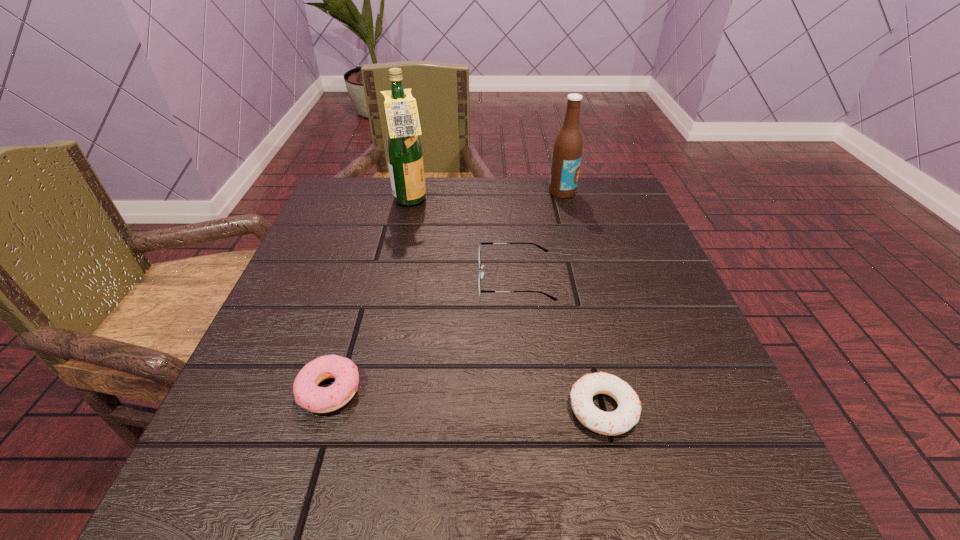
The image size is (960, 540). In order to click on vacant area situated on the lenses of the third shortest object in this screenshot , I will do `click(349, 279)`.

This screenshot has width=960, height=540. Find the location of `free spot located 0.360m on the right of the left doughnut`. free spot located 0.360m on the right of the left doughnut is located at coordinates (602, 390).

This screenshot has height=540, width=960. I want to click on free location located on the back of the right doughnut, so click(571, 274).

I want to click on liquor that is at the far edge, so click(x=404, y=150).

This screenshot has height=540, width=960. What are the coordinates of `beer bottle that is at the far edge` in the screenshot? It's located at (567, 152).

Where is `liquor that is at the left edge`? The height and width of the screenshot is (540, 960). liquor that is at the left edge is located at coordinates (404, 150).

Find the location of a particular element. doughnut that is positioned at the left edge is located at coordinates (307, 393).

Where is `beer bottle present at the right edge`? beer bottle present at the right edge is located at coordinates (567, 152).

Find the location of a particular element. The height and width of the screenshot is (540, 960). doughnut that is at the right edge is located at coordinates (627, 414).

The width and height of the screenshot is (960, 540). What are the coordinates of `object that is positioned at the far left corner` in the screenshot? It's located at tap(404, 150).